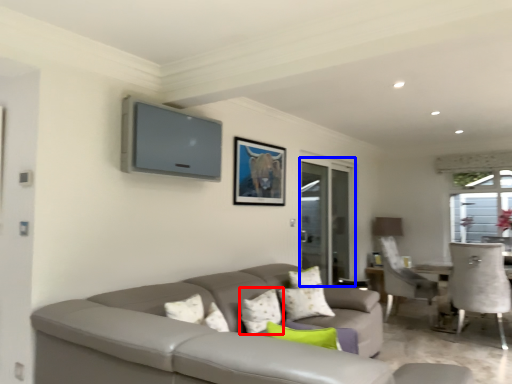
Question: Which point is closer to the camera, pillow (highlighted by a red box) or screen door (highlighted by a blue box)?

Choices:
 (A) pillow
 (B) screen door

Answer: (A)